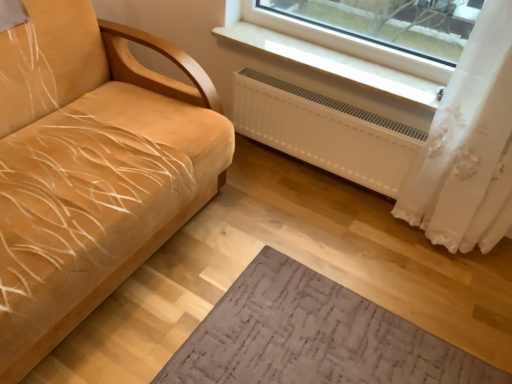
Question: From the image's perspective, is white plastic radiator at upper center above or below velvet yellow couch at left?

Choices:
 (A) above
 (B) below

Answer: (A)

Question: Do you think white plastic radiator at upper center is within velvet yellow couch at left, or outside of it?

Choices:
 (A) inside
 (B) outside

Answer: (B)

Question: Based on their relative distances, which object is nearer to the velvet yellow couch at left?

Choices:
 (A) white plastic radiator at upper center
 (B) white sheer curtain at right
 (C) white matte radiator at lower center

Answer: (C)

Question: Which of these objects is positioned closest to the velvet yellow couch at left?

Choices:
 (A) white plastic radiator at upper center
 (B) white sheer curtain at right
 (C) white matte radiator at lower center

Answer: (C)